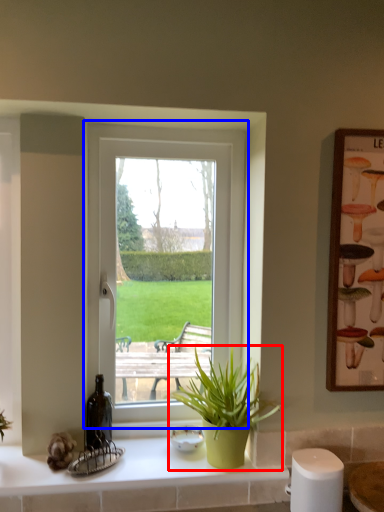
Question: Which point is further to the camera, houseplant (highlighted by a red box) or window (highlighted by a blue box)?

Choices:
 (A) houseplant
 (B) window

Answer: (B)